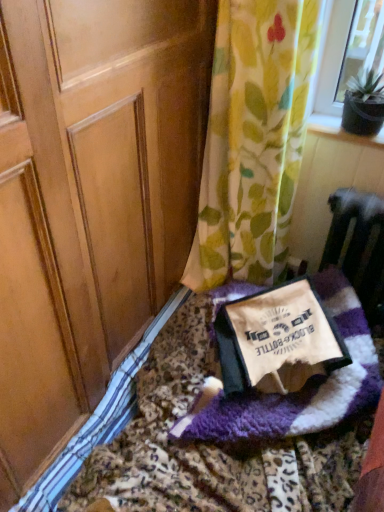
Question: Is floral fabric curtain at upper right facing away from purple fuzzy blanket at lower right?

Choices:
 (A) yes
 (B) no

Answer: (B)

Question: Is floral fabric curtain at upper right completely or partially outside of purple fuzzy blanket at lower right?

Choices:
 (A) yes
 (B) no

Answer: (A)

Question: Is floral fabric curtain at upper right aimed at purple fuzzy blanket at lower right?

Choices:
 (A) yes
 (B) no

Answer: (B)

Question: From the image's perspective, is floral fabric curtain at upper right located beneath purple fuzzy blanket at lower right?

Choices:
 (A) yes
 (B) no

Answer: (B)

Question: From a real-world perspective, does floral fabric curtain at upper right stand above purple fuzzy blanket at lower right?

Choices:
 (A) yes
 (B) no

Answer: (A)

Question: Relative to floral fabric curtain at upper right, is purple fuzzy blanket at lower right in front or behind?

Choices:
 (A) front
 (B) behind

Answer: (A)

Question: Does point (139, 503) appear closer or farther from the camera than point (218, 119)?

Choices:
 (A) farther
 (B) closer

Answer: (B)

Question: In terms of width, does purple fuzzy blanket at lower right look wider or thinner when compared to floral fabric curtain at upper right?

Choices:
 (A) thin
 (B) wide

Answer: (B)

Question: From the image's perspective, is purple fuzzy blanket at lower right positioned above or below floral fabric curtain at upper right?

Choices:
 (A) below
 (B) above

Answer: (A)

Question: From the image's perspective, is floral fabric curtain at upper right positioned above or below beige fleece blanket at center?

Choices:
 (A) below
 (B) above

Answer: (B)

Question: Considering their positions, is floral fabric curtain at upper right located in front of or behind beige fleece blanket at center?

Choices:
 (A) front
 (B) behind

Answer: (A)

Question: Is floral fabric curtain at upper right bigger or smaller than beige fleece blanket at center?

Choices:
 (A) small
 (B) big

Answer: (B)

Question: In terms of width, does floral fabric curtain at upper right look wider or thinner when compared to beige fleece blanket at center?

Choices:
 (A) thin
 (B) wide

Answer: (A)

Question: Would you say floral fabric curtain at upper right is to the left or to the right of purple fuzzy blanket at lower right in the picture?

Choices:
 (A) right
 (B) left

Answer: (A)

Question: Is point (231, 229) positioned closer to the camera than point (243, 486)?

Choices:
 (A) closer
 (B) farther

Answer: (B)